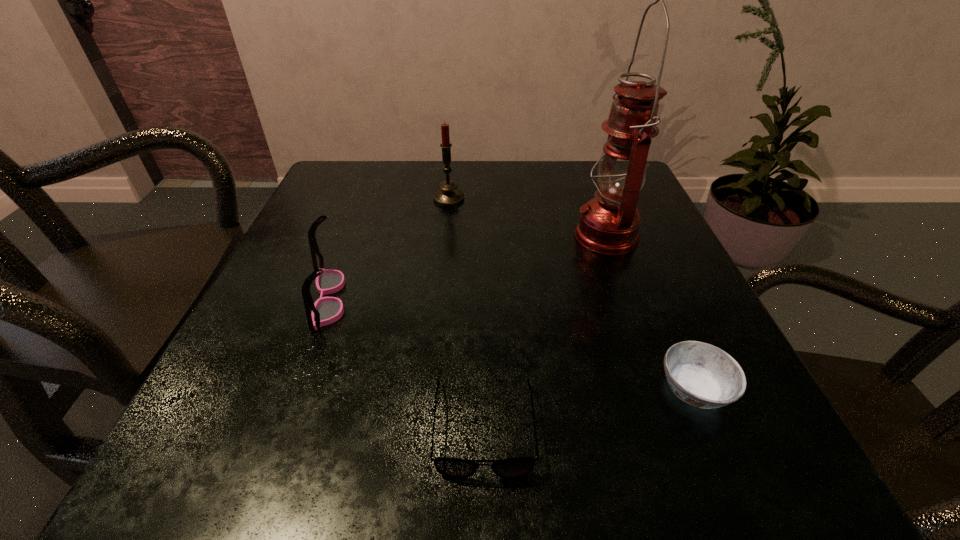
You are a GUI agent. You are given a task and a screenshot of the screen. Output one action in this format:
    pyautogui.click(x=<x>, y=<y>)
    Task: Click on the object that is at the far right corner
    The width and height of the screenshot is (960, 540).
    Given the screenshot: What is the action you would take?
    pyautogui.click(x=609, y=223)

What are the coordinates of `object that is at the near right corner` in the screenshot? It's located at (700, 374).

This screenshot has width=960, height=540. Find the location of `vacant position at the far edge of the desktop`. vacant position at the far edge of the desktop is located at coordinates (469, 169).

The height and width of the screenshot is (540, 960). I want to click on vacant region at the near edge of the desktop, so click(480, 433).

At what (x,y) coordinates should I click in order to perform the action: click on vacant space at the left edge of the desktop. Please return your answer as a coordinate pair (x, y). Image resolution: width=960 pixels, height=540 pixels. Looking at the image, I should click on click(267, 352).

What are the coordinates of `vacant point at the right edge` in the screenshot? It's located at (646, 361).

Where is `vacant space at the far left corner`? vacant space at the far left corner is located at coordinates (364, 198).

In order to click on free location at the near left corner of the desktop in this screenshot , I will do `click(308, 424)`.

You are a GUI agent. You are given a task and a screenshot of the screen. Output one action in this format:
    pyautogui.click(x=<x>, y=<y>)
    Task: Click on the free point at the far right corner
    
    Given the screenshot: What is the action you would take?
    pyautogui.click(x=598, y=172)

Find the location of `free area in between the third nearest object and the ashtray`. free area in between the third nearest object and the ashtray is located at coordinates (511, 344).